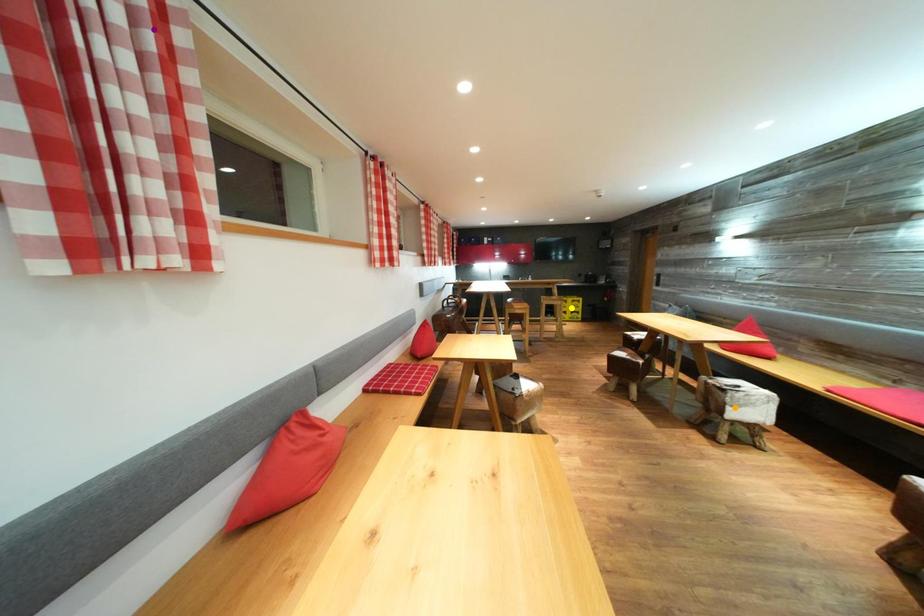
Order these from nearest to farthest:
orange point
purple point
yellow point

purple point, orange point, yellow point